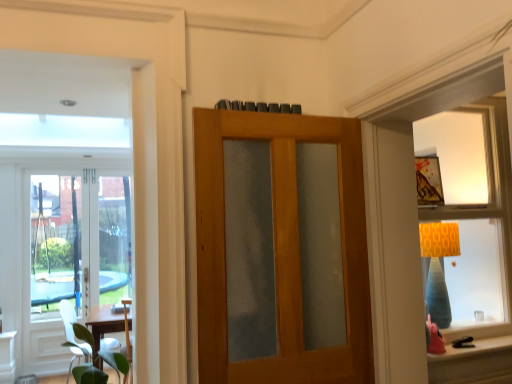
Question: From a real-world perspective, is matte orange lampshade at upper right positioned over wooden door with frosted glass at center, the first door viewed from the front, based on gravity?

Choices:
 (A) yes
 (B) no

Answer: (A)

Question: Can you confirm if matte orange lampshade at upper right is bigger than wooden door with frosted glass at center, which ranks as the second door in back-to-front order?

Choices:
 (A) no
 (B) yes

Answer: (B)

Question: From the image's perspective, would you say matte orange lampshade at upper right is positioned over wooden door with frosted glass at center, the first door positioned from the right?

Choices:
 (A) no
 (B) yes

Answer: (B)

Question: From the image's perspective, is matte orange lampshade at upper right below wooden door with frosted glass at center, the first door positioned from the right?

Choices:
 (A) no
 (B) yes

Answer: (A)

Question: Can you confirm if matte orange lampshade at upper right is thinner than wooden door with frosted glass at center, positioned as the 2th door in left-to-right order?

Choices:
 (A) no
 (B) yes

Answer: (A)

Question: Is the surface of matte orange lampshade at upper right in direct contact with wooden door with frosted glass at center, which ranks as the second door in back-to-front order?

Choices:
 (A) no
 (B) yes

Answer: (A)

Question: Does matte orange lampshade at lower right have a lesser height compared to matte orange lampshade at upper right?

Choices:
 (A) no
 (B) yes

Answer: (B)

Question: From a real-world perspective, is matte orange lampshade at lower right under matte orange lampshade at upper right?

Choices:
 (A) no
 (B) yes

Answer: (B)

Question: Does matte orange lampshade at lower right turn towards matte orange lampshade at upper right?

Choices:
 (A) yes
 (B) no

Answer: (B)

Question: Is matte orange lampshade at upper right a part of matte orange lampshade at lower right?

Choices:
 (A) no
 (B) yes

Answer: (A)

Question: Does matte orange lampshade at lower right have a larger size compared to matte orange lampshade at upper right?

Choices:
 (A) no
 (B) yes

Answer: (A)

Question: From the image's perspective, is matte orange lampshade at lower right located beneath matte orange lampshade at upper right?

Choices:
 (A) no
 (B) yes

Answer: (B)

Question: Does wooden door with frosted glass at center, the first door viewed from the front, touch matte orange lampshade at upper right?

Choices:
 (A) no
 (B) yes

Answer: (A)